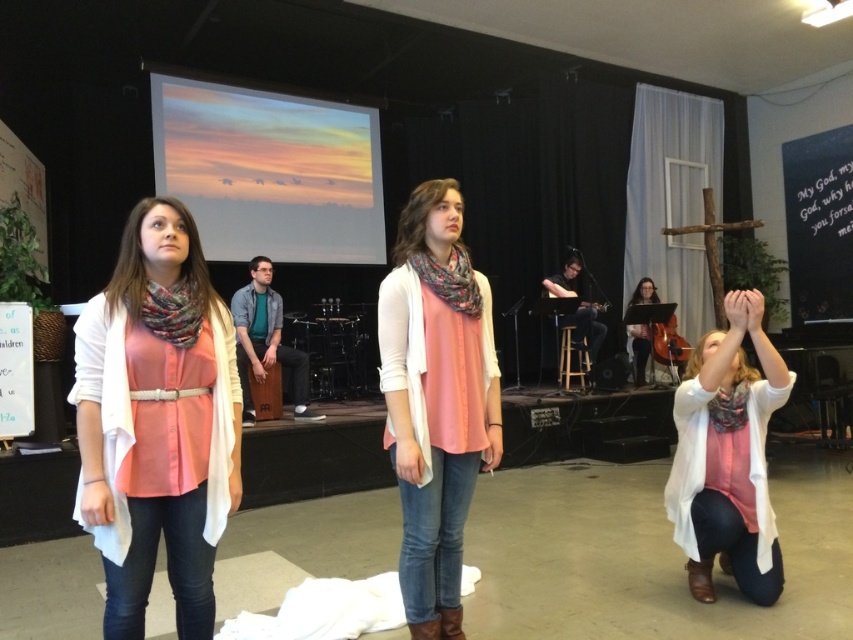
Question: Considering the real-world distances, which object is farthest from the multicolored knit scarf at center?

Choices:
 (A) pastel sky at upper center
 (B) printed silk scarf at left
 (C) matte pink scarf at lower right
 (D) matte pink blouse at center

Answer: (A)

Question: Can you confirm if matte pink scarf at lower right is positioned above printed silk scarf at left?

Choices:
 (A) yes
 (B) no

Answer: (B)

Question: Where is matte pink blouse at center located in relation to pastel sky at upper center in the image?

Choices:
 (A) above
 (B) below

Answer: (B)

Question: Which point is farther from the camera taking this photo?

Choices:
 (A) tap(695, 465)
 (B) tap(190, 278)
 (C) tap(250, 188)

Answer: (C)

Question: Is matte pink blouse at center in front of matte pink scarf at lower right?

Choices:
 (A) yes
 (B) no

Answer: (A)

Question: Which object appears farthest from the camera in this image?

Choices:
 (A) matte pink scarf at lower right
 (B) matte black cello at center
 (C) multicolored knit scarf at center
 (D) printed silk scarf at left

Answer: (B)